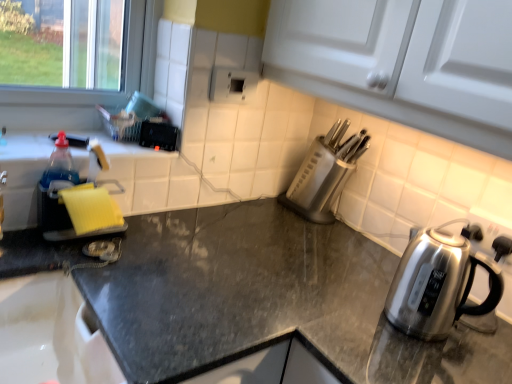
Where is `free space to the left of satin silver kettle at right`? The height and width of the screenshot is (384, 512). free space to the left of satin silver kettle at right is located at coordinates (339, 301).